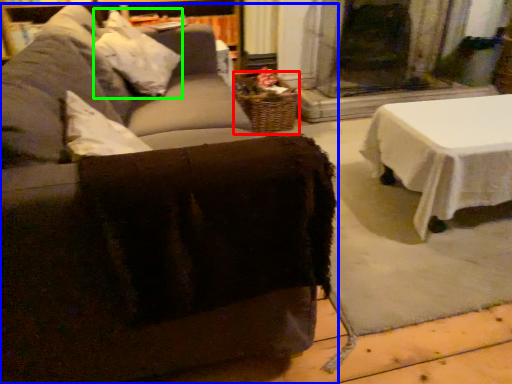
Question: Considering the real-world distances, which object is farthest from basket (highlighted by a red box)? studio couch (highlighted by a blue box) or pillow (highlighted by a green box)?

Choices:
 (A) studio couch
 (B) pillow

Answer: (A)